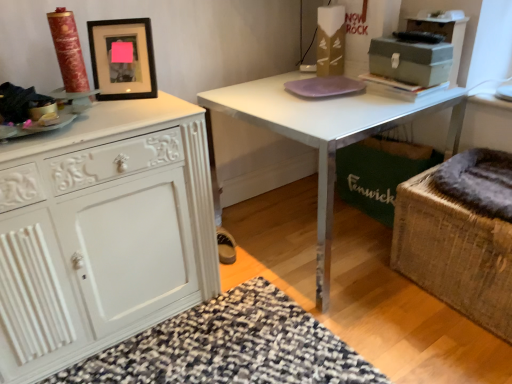
The height and width of the screenshot is (384, 512). I want to click on vacant space in white glossy table at center (from a real-world perspective), so click(306, 236).